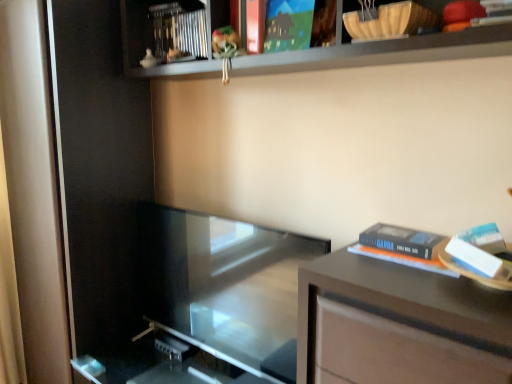
Question: Considering the positions of transparent glass screen door at left, placed as the second screen door when sorted from left to right, and matte brown table at right in the image, is transparent glass screen door at left, placed as the second screen door when sorted from left to right, bigger or smaller than matte brown table at right?

Choices:
 (A) big
 (B) small

Answer: (A)

Question: In the image, is transparent glass screen door at left, placed as the second screen door when sorted from left to right, on the left side or the right side of matte brown table at right?

Choices:
 (A) right
 (B) left

Answer: (B)

Question: Which object is the farthest from the matte paper at upper center, the first paperback book when ordered from top to bottom?

Choices:
 (A) transparent glass door at center
 (B) hardcover book at right, the second paperback book when ordered from top to bottom
 (C) matte brown table at right
 (D) metallic silver book at upper center
 (E) wooden shelf at upper center

Answer: (A)

Question: Which object is positioned closest to the matte paper at upper center, the first paperback book when ordered from top to bottom?

Choices:
 (A) wooden shelf at upper center
 (B) hardcover book at right, which ranks as the 2th paperback book in left-to-right order
 (C) transparent glass door at center
 (D) matte brown table at right
 (E) matte white screen door at left, which is counted as the second screen door, starting from the right

Answer: (A)